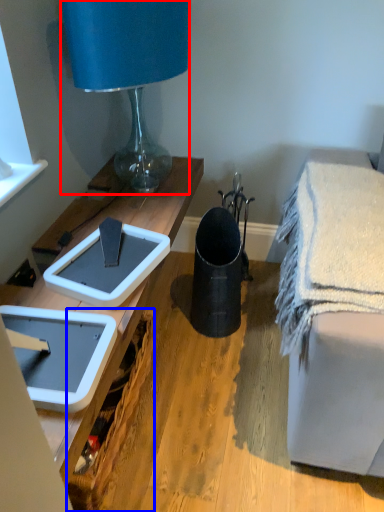
Question: Which of the following is the farthest to the observer, lamp (highlighted by a red box) or picnic basket (highlighted by a blue box)?

Choices:
 (A) lamp
 (B) picnic basket

Answer: (A)